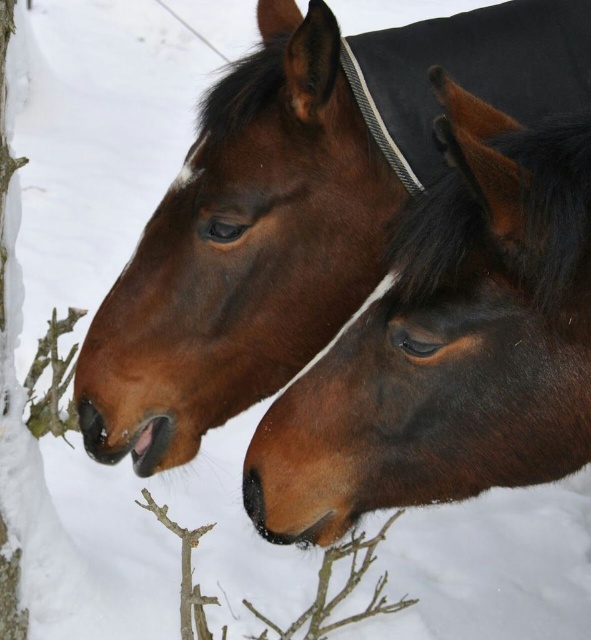
At what (x,y) coordinates should I click in order to perform the action: click on brown glossy horse at center. Please return your answer as a coordinate pair (x, y). Looking at the image, I should click on (447, 342).

Between point (339, 452) and point (362, 531), which one is positioned in front?

Point (339, 452)

Is point (353, 344) behind point (196, 538)?

No, (353, 344) is closer to viewer.

You are a GUI agent. You are given a task and a screenshot of the screen. Output one action in this format:
    pyautogui.click(x=<x>, y=<y>)
    Task: Click on the brown glossy horse at center
    Image resolution: width=591 pixels, height=640 pixels.
    Given the screenshot: What is the action you would take?
    pyautogui.click(x=447, y=342)